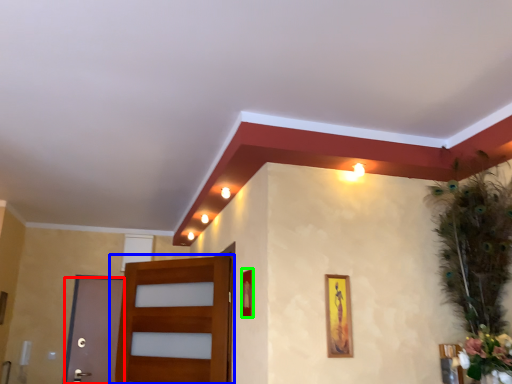
Question: Which object is positioned farthest from door (highlighted by a red box)? Select from door (highlighted by a blue box) and picture frame (highlighted by a green box).

Choices:
 (A) door
 (B) picture frame

Answer: (B)